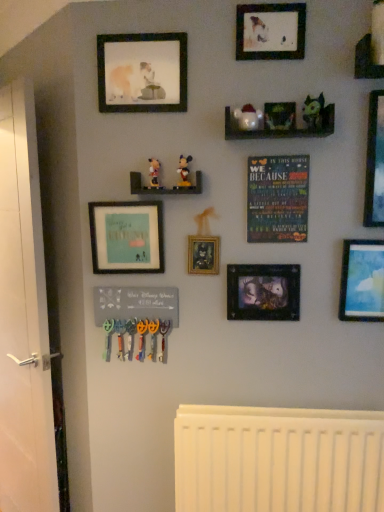
Question: Is wooden poster at center at the right side of white glossy door at left?

Choices:
 (A) no
 (B) yes

Answer: (B)

Question: Is wooden poster at center oriented towards white glossy door at left?

Choices:
 (A) no
 (B) yes

Answer: (A)

Question: Does wooden poster at center have a greater width compared to white glossy door at left?

Choices:
 (A) yes
 (B) no

Answer: (B)

Question: Is wooden poster at center in contact with white glossy door at left?

Choices:
 (A) yes
 (B) no

Answer: (B)

Question: Could white glossy door at left be considered to be inside wooden poster at center?

Choices:
 (A) yes
 (B) no

Answer: (B)

Question: Is white glossy door at left at the back of wooden poster at center?

Choices:
 (A) yes
 (B) no

Answer: (B)

Question: Does matte green plush toy at upper right, which ranks as the first toy in right-to-left order, have a lesser width compared to wooden mickey mouse figurines at center, which is counted as the 3th shelf, starting from the right?

Choices:
 (A) no
 (B) yes

Answer: (B)

Question: Does matte green plush toy at upper right, the 4th toy positioned from the left, have a lesser height compared to wooden mickey mouse figurines at center, which appears as the 3th shelf when viewed from the top?

Choices:
 (A) yes
 (B) no

Answer: (B)

Question: Is matte green plush toy at upper right, which ranks as the first toy in right-to-left order, far from wooden mickey mouse figurines at center, placed as the first shelf when sorted from bottom to top?

Choices:
 (A) no
 (B) yes

Answer: (A)

Question: Would you say wooden mickey mouse figurines at center, placed as the first shelf when sorted from bottom to top, is part of matte green plush toy at upper right, which ranks as the first toy in right-to-left order,'s contents?

Choices:
 (A) no
 (B) yes

Answer: (A)

Question: Is matte green plush toy at upper right, the 4th toy positioned from the left, positioned beyond the bounds of wooden mickey mouse figurines at center, the 1th shelf positioned from the left?

Choices:
 (A) yes
 (B) no

Answer: (A)

Question: Does matte green plush toy at upper right, the 4th toy positioned from the left, have a greater width compared to wooden mickey mouse figurines at center, which appears as the 3th shelf when viewed from the top?

Choices:
 (A) yes
 (B) no

Answer: (B)

Question: From the image's perspective, is matte blue sky at right, which ranks as the sixth picture frame in left-to-right order, above wooden shelf at upper right, which is counted as the 1th shelf, starting from the right?

Choices:
 (A) yes
 (B) no

Answer: (B)